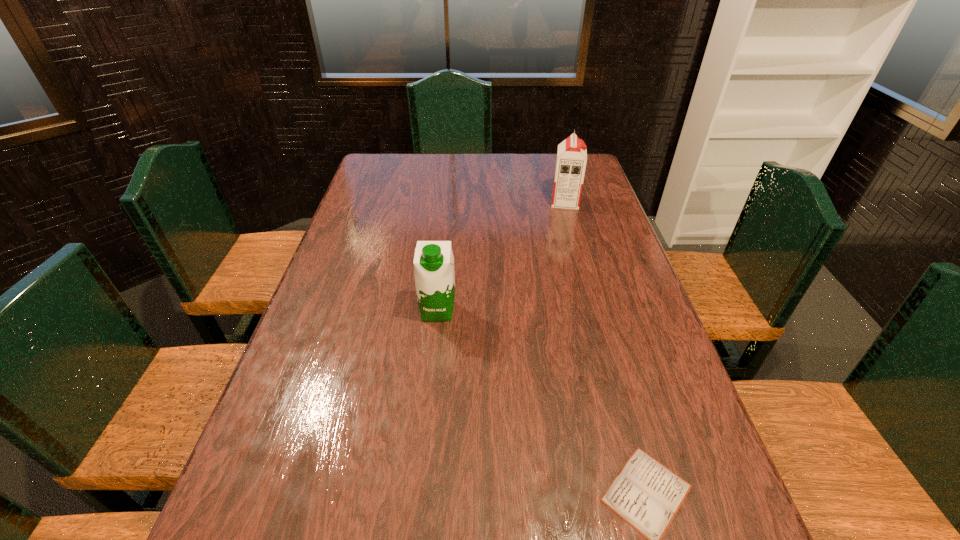
The height and width of the screenshot is (540, 960). I want to click on the farther soya milk, so click(x=571, y=160).

You are a GUI agent. You are given a task and a screenshot of the screen. Output one action in this format:
    pyautogui.click(x=<x>, y=<y>)
    Task: Click on the right soya milk
    The image size is (960, 540).
    Given the screenshot: What is the action you would take?
    pyautogui.click(x=571, y=160)

At what (x,y) coordinates should I click in order to perform the action: click on the left soya milk. Please return your answer as a coordinate pair (x, y). Looking at the image, I should click on (434, 274).

Locate an element on the screen. This screenshot has height=540, width=960. the leftmost object is located at coordinates (434, 274).

This screenshot has width=960, height=540. I want to click on free spot located on the back of the farthest object, so click(x=552, y=154).

Find the location of `free spot located 0.200m on the front-facing side of the nearer soya milk`. free spot located 0.200m on the front-facing side of the nearer soya milk is located at coordinates (430, 390).

Image resolution: width=960 pixels, height=540 pixels. Find the location of `object located in the right edge section of the desktop`. object located in the right edge section of the desktop is located at coordinates (571, 160).

Identify the location of vacant area at the left edge. The image size is (960, 540). (356, 314).

Identify the location of vacant region at the right edge. This screenshot has width=960, height=540. (597, 246).

In the image, there is a desktop. Find the location of `blank space at the far left corner`. blank space at the far left corner is located at coordinates (400, 170).